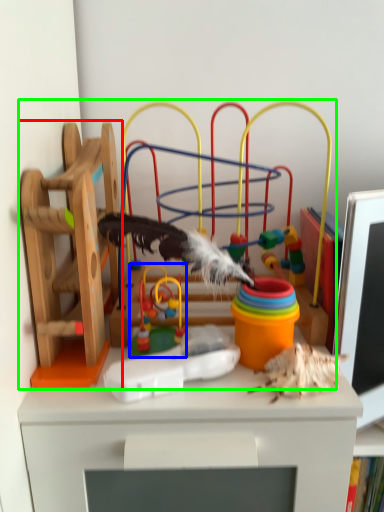
Question: Which is nearer to the toy (highlighted by a red box)? toy (highlighted by a blue box) or toy (highlighted by a green box).

Choices:
 (A) toy
 (B) toy

Answer: (B)